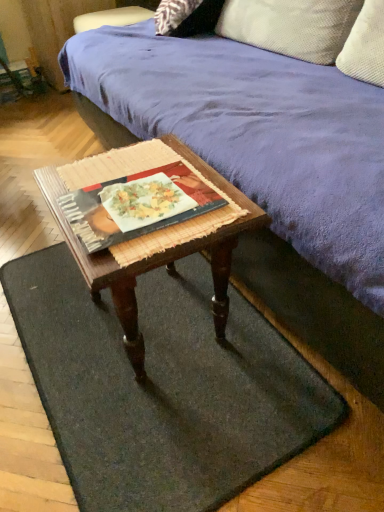
This screenshot has width=384, height=512. I want to click on vacant space situated above matte black book at center (from a real-world perspective), so click(x=139, y=196).